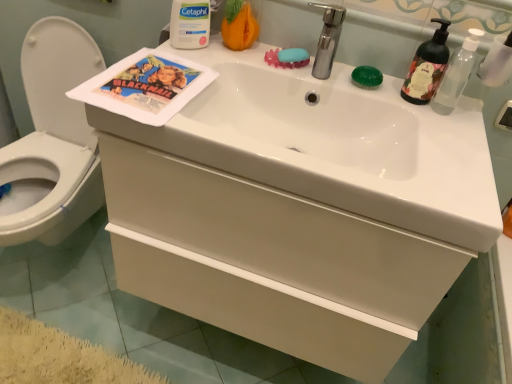
Image resolution: width=512 pixels, height=384 pixels. In order to click on free space in front of white matte cetaphil container at upper center in this screenshot , I will do `click(170, 70)`.